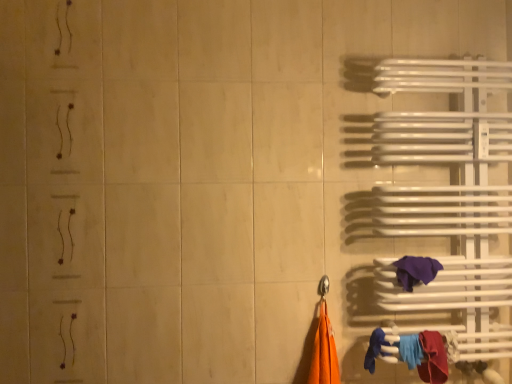
What do you see at coordinates (433, 358) in the screenshot? This screenshot has width=512, height=384. I see `red fabric towel at lower right, the 1th towel ordered from the bottom` at bounding box center [433, 358].

Find the location of a particular element. The height and width of the screenshot is (384, 512). red fabric towel at lower right, the 1th towel ordered from the bottom is located at coordinates (433, 358).

What is the approximate height of purple fabric towel at right, arranged as the 1th towel when viewed from the top?

purple fabric towel at right, arranged as the 1th towel when viewed from the top, is 5.60 inches tall.

Locate an element on the screen. This screenshot has height=384, width=512. purple fabric towel at right, acting as the second towel starting from the bottom is located at coordinates (416, 271).

Image resolution: width=512 pixels, height=384 pixels. Describe the element at coordinates (416, 271) in the screenshot. I see `purple fabric towel at right, acting as the second towel starting from the bottom` at that location.

Find the location of a particular element. Image resolution: width=512 pixels, height=384 pixels. red fabric towel at lower right, which is the 2th towel in top-to-bottom order is located at coordinates (433, 358).

Between purple fabric towel at right, acting as the second towel starting from the bottom, and red fabric towel at lower right, the 1th towel ordered from the bottom, which one appears on the right side from the viewer's perspective?

From the viewer's perspective, red fabric towel at lower right, the 1th towel ordered from the bottom, appears more on the right side.

Is the depth of purple fabric towel at right, arranged as the 1th towel when viewed from the top, greater than that of red fabric towel at lower right, the 1th towel ordered from the bottom?

Yes, it is behind red fabric towel at lower right, the 1th towel ordered from the bottom.

Considering the positions of points (420, 263) and (438, 372), is point (420, 263) closer to camera compared to point (438, 372)?

No, (420, 263) is further to viewer.

From the image's perspective, which object appears higher, purple fabric towel at right, arranged as the 1th towel when viewed from the top, or red fabric towel at lower right, the 1th towel ordered from the bottom?

purple fabric towel at right, arranged as the 1th towel when viewed from the top, appears higher in the image.

From a real-world perspective, is purple fabric towel at right, arranged as the 1th towel when viewed from the top, over red fabric towel at lower right, which is the 2th towel in top-to-bottom order?

Yes, from a real-world perspective, purple fabric towel at right, arranged as the 1th towel when viewed from the top, is over red fabric towel at lower right, which is the 2th towel in top-to-bottom order

Between purple fabric towel at right, acting as the second towel starting from the bottom, and red fabric towel at lower right, which is the 2th towel in top-to-bottom order, which one has smaller width?

purple fabric towel at right, acting as the second towel starting from the bottom.

Considering the sizes of purple fabric towel at right, acting as the second towel starting from the bottom, and red fabric towel at lower right, the 1th towel ordered from the bottom, in the image, is purple fabric towel at right, acting as the second towel starting from the bottom, taller or shorter than red fabric towel at lower right, the 1th towel ordered from the bottom,?

Considering their sizes, purple fabric towel at right, acting as the second towel starting from the bottom, has less height than red fabric towel at lower right, the 1th towel ordered from the bottom.

In terms of size, does purple fabric towel at right, arranged as the 1th towel when viewed from the top, appear bigger or smaller than red fabric towel at lower right, which is the 2th towel in top-to-bottom order?

Considering their sizes, purple fabric towel at right, arranged as the 1th towel when viewed from the top, takes up less space than red fabric towel at lower right, which is the 2th towel in top-to-bottom order.

Is purple fabric towel at right, acting as the second towel starting from the bottom, not inside red fabric towel at lower right, the 1th towel ordered from the bottom?

purple fabric towel at right, acting as the second towel starting from the bottom, lies outside red fabric towel at lower right, the 1th towel ordered from the bottom,'s area.

Is purple fabric towel at right, acting as the second towel starting from the bottom, next to red fabric towel at lower right, which is the 2th towel in top-to-bottom order?

No, purple fabric towel at right, acting as the second towel starting from the bottom, is not next to red fabric towel at lower right, which is the 2th towel in top-to-bottom order.

Is purple fabric towel at right, arranged as the 1th towel when viewed from the top, facing towards red fabric towel at lower right, which is the 2th towel in top-to-bottom order?

No, purple fabric towel at right, arranged as the 1th towel when viewed from the top, is not aimed at red fabric towel at lower right, which is the 2th towel in top-to-bottom order.

This screenshot has height=384, width=512. I want to click on towel that appears below the purple fabric towel at right, acting as the second towel starting from the bottom (from the image's perspective), so pyautogui.click(x=433, y=358).

Which is more to the left, red fabric towel at lower right, which is the 2th towel in top-to-bottom order, or purple fabric towel at right, arranged as the 1th towel when viewed from the top?

purple fabric towel at right, arranged as the 1th towel when viewed from the top.

Is the position of red fabric towel at lower right, which is the 2th towel in top-to-bottom order, more distant than that of purple fabric towel at right, arranged as the 1th towel when viewed from the top?

No, red fabric towel at lower right, which is the 2th towel in top-to-bottom order, is closer to the camera.

Is point (423, 363) positioned in front of point (418, 266)?

Yes, it is.

From the image's perspective, does red fabric towel at lower right, which is the 2th towel in top-to-bottom order, appear lower than purple fabric towel at right, acting as the second towel starting from the bottom?

Yes, from the image's perspective, red fabric towel at lower right, which is the 2th towel in top-to-bottom order, is below purple fabric towel at right, acting as the second towel starting from the bottom.

From a real-world perspective, which object stands above the other?

In real-world perspective, purple fabric towel at right, acting as the second towel starting from the bottom, is above.

In terms of width, does red fabric towel at lower right, which is the 2th towel in top-to-bottom order, look wider or thinner when compared to purple fabric towel at right, acting as the second towel starting from the bottom?

red fabric towel at lower right, which is the 2th towel in top-to-bottom order, is wider than purple fabric towel at right, acting as the second towel starting from the bottom.

Is red fabric towel at lower right, the 1th towel ordered from the bottom, taller or shorter than purple fabric towel at right, arranged as the 1th towel when viewed from the top?

Considering their sizes, red fabric towel at lower right, the 1th towel ordered from the bottom, has more height than purple fabric towel at right, arranged as the 1th towel when viewed from the top.

Considering the sizes of objects red fabric towel at lower right, which is the 2th towel in top-to-bottom order, and purple fabric towel at right, acting as the second towel starting from the bottom, in the image provided, who is bigger, red fabric towel at lower right, which is the 2th towel in top-to-bottom order, or purple fabric towel at right, acting as the second towel starting from the bottom,?

Bigger between the two is red fabric towel at lower right, which is the 2th towel in top-to-bottom order.

Is red fabric towel at lower right, which is the 2th towel in top-to-bottom order, not inside purple fabric towel at right, acting as the second towel starting from the bottom?

Yes, red fabric towel at lower right, which is the 2th towel in top-to-bottom order, is not within purple fabric towel at right, acting as the second towel starting from the bottom.

Is red fabric towel at lower right, the 1th towel ordered from the bottom, not near purple fabric towel at right, acting as the second towel starting from the bottom?

Actually, red fabric towel at lower right, the 1th towel ordered from the bottom, and purple fabric towel at right, acting as the second towel starting from the bottom, are a little close together.

Is red fabric towel at lower right, the 1th towel ordered from the bottom, looking in the opposite direction of purple fabric towel at right, acting as the second towel starting from the bottom?

No, red fabric towel at lower right, the 1th towel ordered from the bottom,'s orientation is not away from purple fabric towel at right, acting as the second towel starting from the bottom.

The image size is (512, 384). I want to click on towel that appears on the left of red fabric towel at lower right, the 1th towel ordered from the bottom, so click(416, 271).

Where is `towel that is in front of the purple fabric towel at right, acting as the second towel starting from the bottom`? towel that is in front of the purple fabric towel at right, acting as the second towel starting from the bottom is located at coordinates (433, 358).

Where is `towel behind the red fabric towel at lower right, the 1th towel ordered from the bottom`? towel behind the red fabric towel at lower right, the 1th towel ordered from the bottom is located at coordinates (416, 271).